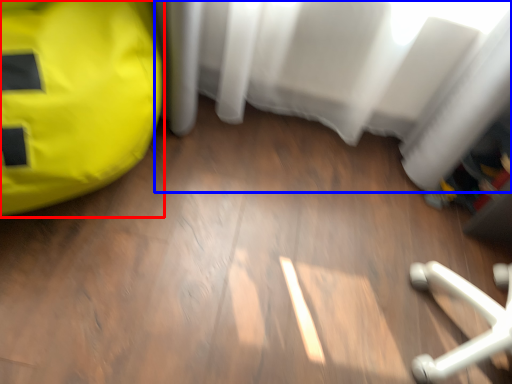
Question: Which of the following is the closest to the observer, bean bag chair (highlighted by a red box) or curtain (highlighted by a blue box)?

Choices:
 (A) bean bag chair
 (B) curtain

Answer: (A)